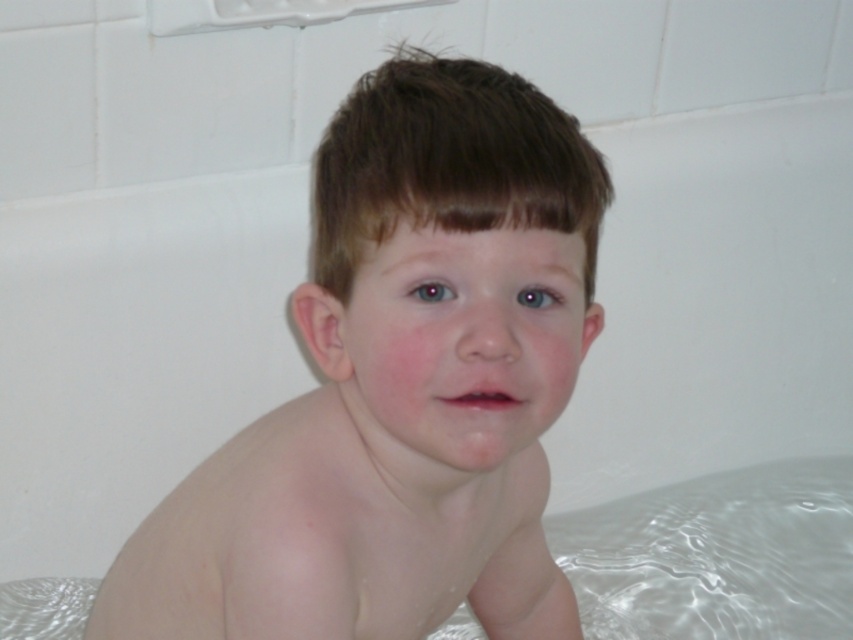
In the scene shown: In the bathroom scene, there is a pale skin child at center and a transparent plastic diaper at lower left. From the perspective of someone standing in front of the bathtub, which object is positioned to the right?

The pale skin child at center is positioned to the right of the transparent plastic diaper at lower left.

Based on the scene description, which object is larger in size between the pale skin child at center and the transparent plastic diaper at lower left?

The pale skin child at center is bigger than the transparent plastic diaper at lower left according to the description.

You are a photographer taking a picture of the pale skin child at center in the bathtub. To ensure the child is centered in the frame, where should you position your camera relative to the point at point (399, 385)?

The pale skin child at center is located at point (399, 385), so you should position your camera directly facing that point to center the child in the frame.